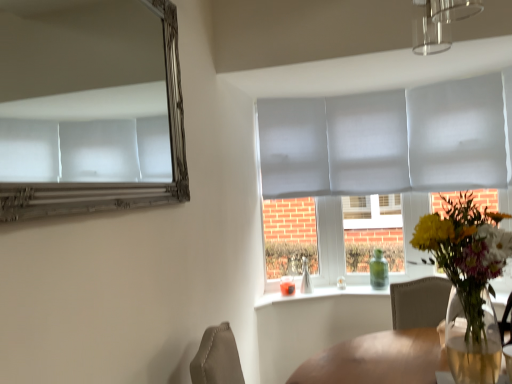
Find the location of `vacant region to the left of green glass bottle at window`. vacant region to the left of green glass bottle at window is located at coordinates (357, 287).